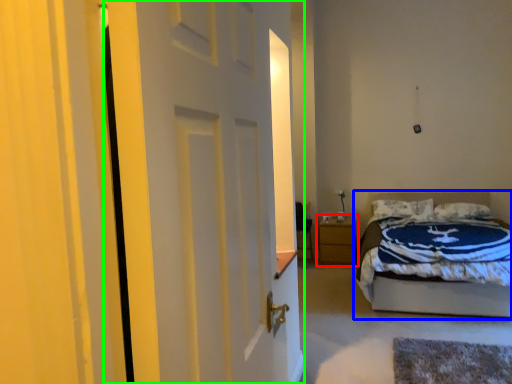
Question: Which object is the farthest from nightstand (highlighted by a red box)? Choose among these: bed (highlighted by a blue box) or door (highlighted by a green box).

Choices:
 (A) bed
 (B) door

Answer: (B)